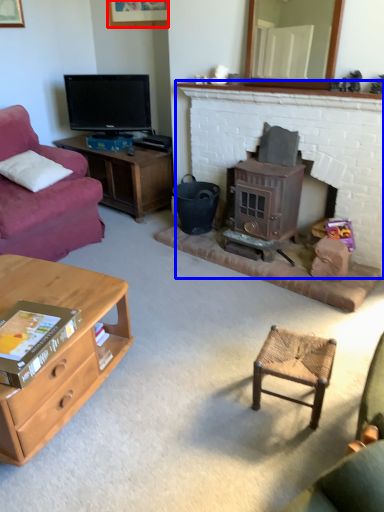
Question: Which object is closer to the camera taking this photo, picture frame (highlighted by a red box) or fireplace (highlighted by a blue box)?

Choices:
 (A) picture frame
 (B) fireplace

Answer: (B)